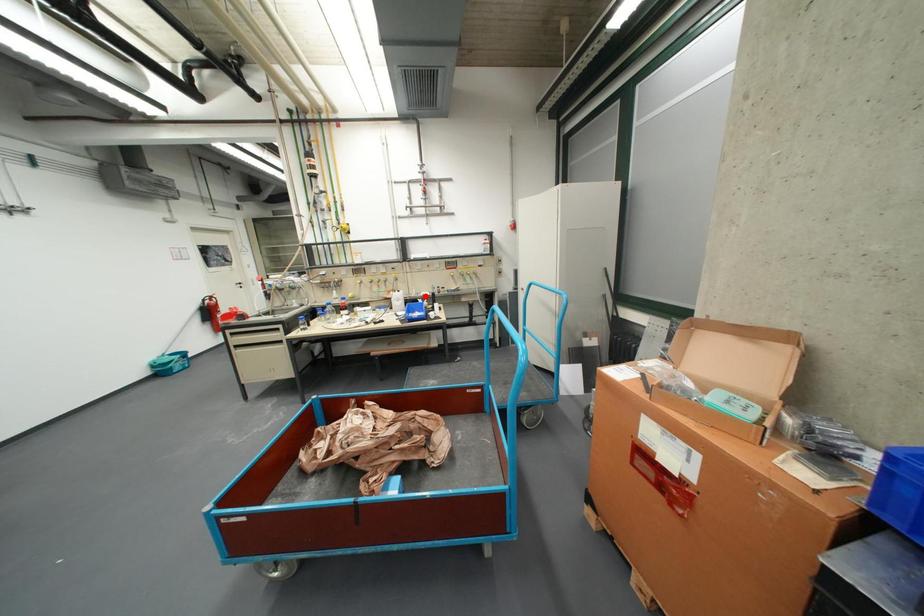
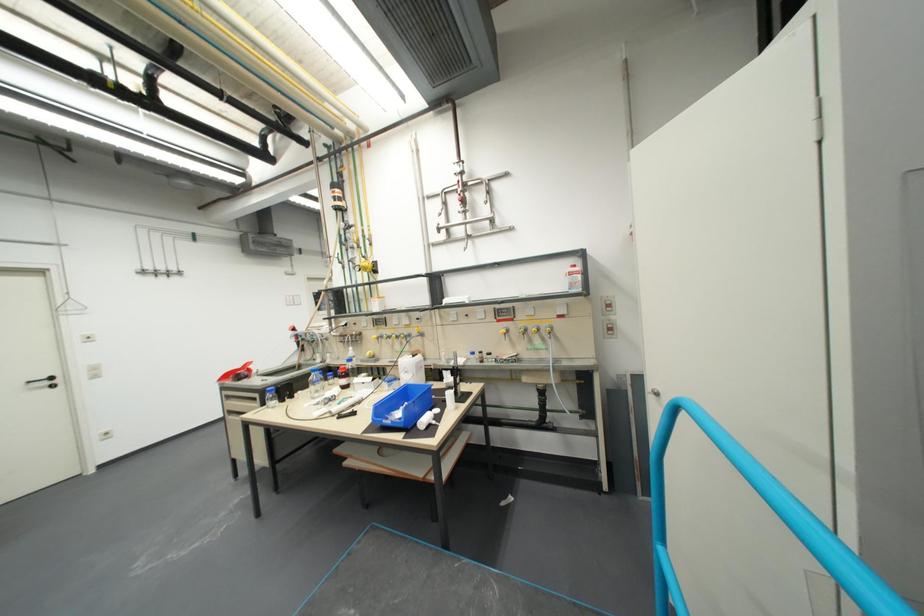
The point at the highlighted location is marked in the first image. Where is the corresponding point in the second image?

(455, 363)